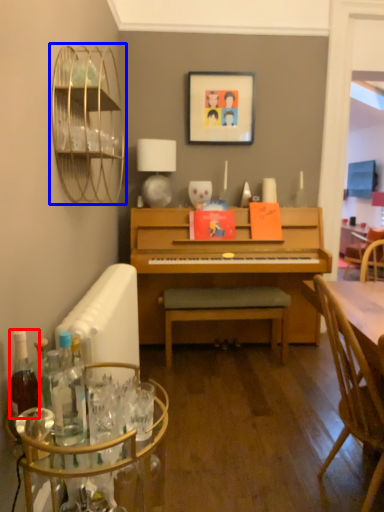
Question: Which of the following is the farthest to the observer, bottle (highlighted by a red box) or bird cage (highlighted by a blue box)?

Choices:
 (A) bottle
 (B) bird cage

Answer: (B)